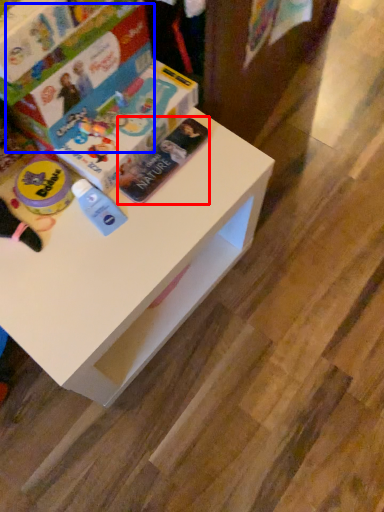
Question: Which point is further to the camera, paperback book (highlighted by a red box) or paperback book (highlighted by a blue box)?

Choices:
 (A) paperback book
 (B) paperback book

Answer: (A)